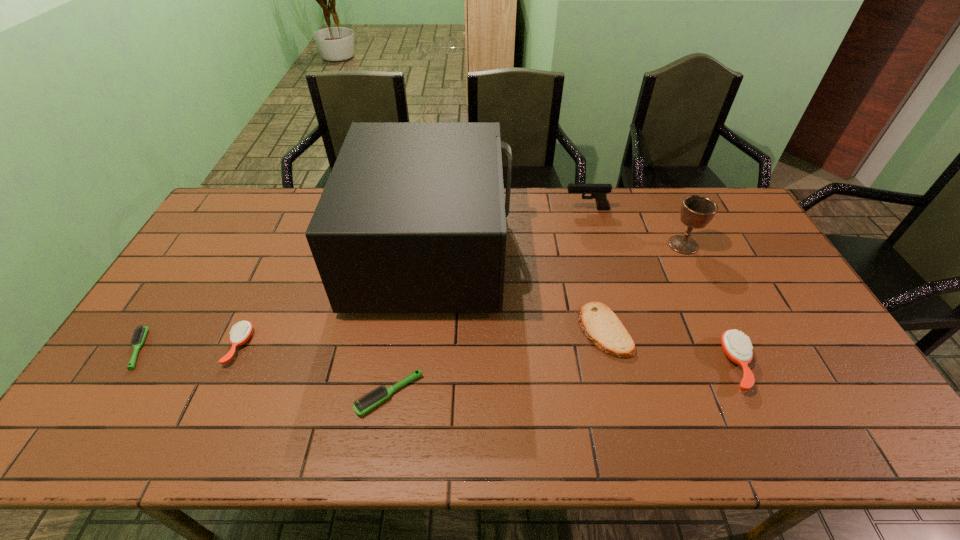
What are the coordinates of `vacant space located 0.330m on the right of the right light hairbrush` in the screenshot? It's located at tap(556, 394).

In order to click on vacant space located on the front of the shortest object in this screenshot , I will do `click(83, 435)`.

Locate an element on the screen. The width and height of the screenshot is (960, 540). microwave oven at the far edge is located at coordinates (412, 219).

Where is `pistol present at the far edge`? The image size is (960, 540). pistol present at the far edge is located at coordinates (599, 192).

Where is `object present at the near edge`? This screenshot has width=960, height=540. object present at the near edge is located at coordinates (373, 398).

Where is `object present at the left edge`? object present at the left edge is located at coordinates (139, 335).

The height and width of the screenshot is (540, 960). Find the location of `vacant region at the far edge of the desktop`. vacant region at the far edge of the desktop is located at coordinates (602, 210).

Image resolution: width=960 pixels, height=540 pixels. Identify the location of vacant position at the near edge of the desktop. (756, 428).

Locate an element on the screen. This screenshot has height=540, width=960. vacant space at the left edge is located at coordinates (246, 247).

Where is `vacant space at the far left corner of the desktop`? The height and width of the screenshot is (540, 960). vacant space at the far left corner of the desktop is located at coordinates (253, 192).